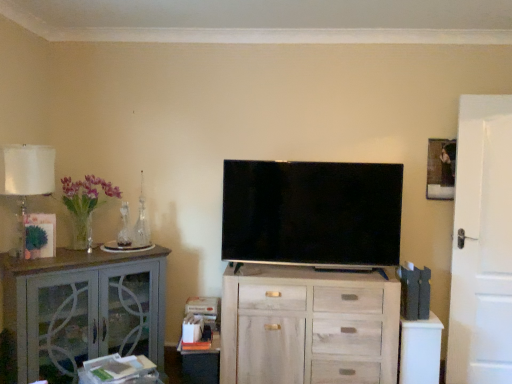
Question: Considering the positions of white matte door at right and translucent glass vase at left in the image, is white matte door at right bigger or smaller than translucent glass vase at left?

Choices:
 (A) big
 (B) small

Answer: (B)

Question: Would you say white matte door at right is to the left or to the right of translucent glass vase at left in the picture?

Choices:
 (A) left
 (B) right

Answer: (B)

Question: Which is nearer to the clear glass vase at left?

Choices:
 (A) translucent glass table lamp at left
 (B) wooden picture frame at upper right
 (C) matte black tv at center
 (D) white wood cabinet at lower right
 (E) white matte door at right

Answer: (A)

Question: Which of these objects is positioned closest to the white wood chest of drawers at center?

Choices:
 (A) white wood cabinet at lower right
 (B) white matte door at right
 (C) wooden picture frame at upper right
 (D) matte gray cabinet at left
 (E) translucent glass vase at left

Answer: (A)